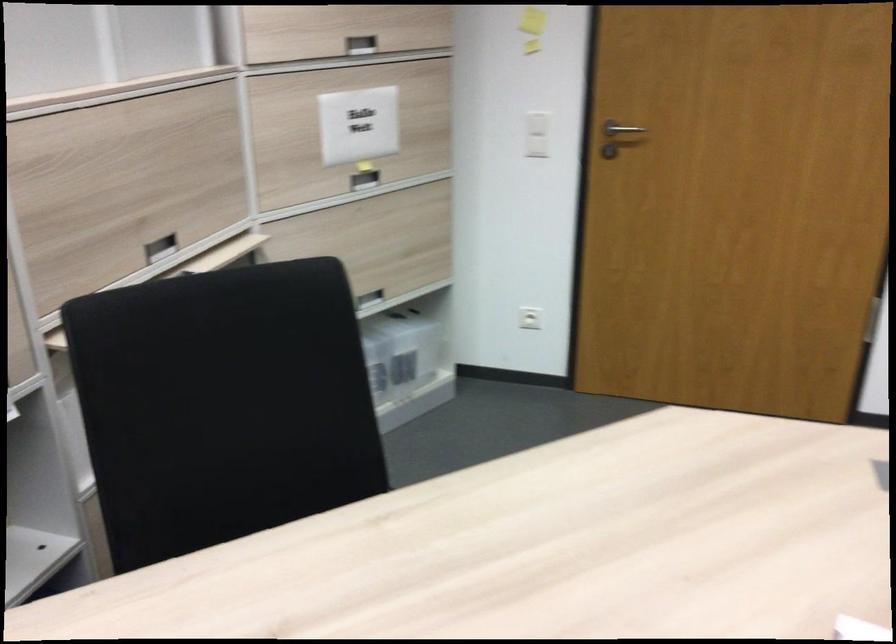
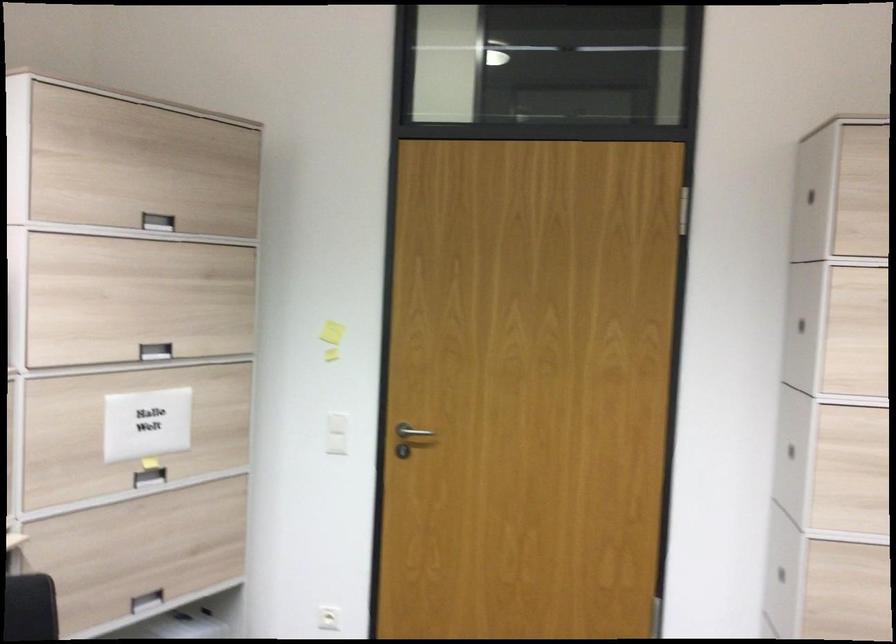
Question: In a continuous first-person perspective shot, in which direction is the camera moving?

Choices:
 (A) Left
 (B) Right
 (C) Forward
 (D) Backward

Answer: (B)